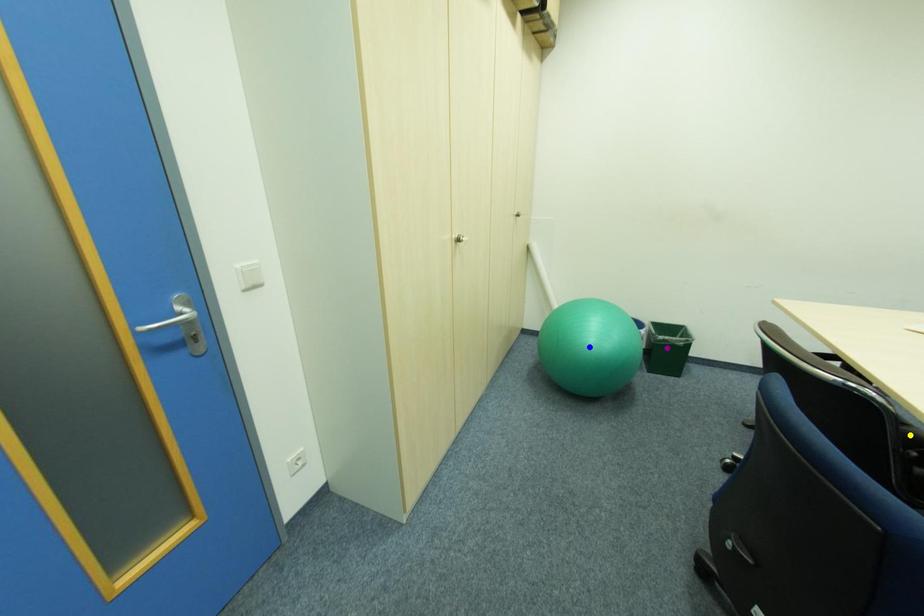
Order these from nearest to farthest:
- purple point
- yellow point
- blue point

1. yellow point
2. purple point
3. blue point